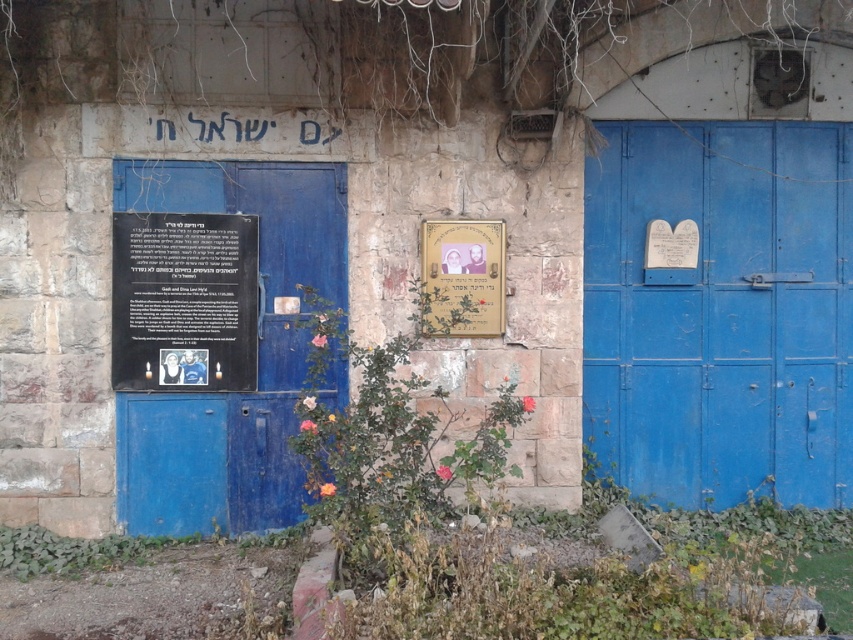
Question: Which of these objects is positioned closest to the green leafy plant at center?

Choices:
 (A) black metal plaque at left
 (B) gold metallic plaque at center
 (C) blue matte door at center
 (D) black matte signboard at left

Answer: (B)

Question: Can you confirm if black matte signboard at left is thinner than gold metallic plaque at center?

Choices:
 (A) yes
 (B) no

Answer: (B)

Question: Which point appears farthest from the camera in this image?

Choices:
 (A) [223, 166]
 (B) [239, 230]
 (C) [608, 186]
 (D) [314, 412]

Answer: (C)

Question: Can you confirm if black metal plaque at left is bigger than black matte signboard at left?

Choices:
 (A) no
 (B) yes

Answer: (B)

Question: Which point is farther to the camera?

Choices:
 (A) (624, 474)
 (B) (489, 289)
 (C) (202, 365)

Answer: (A)

Question: Is blue matte door at center to the right of gold metallic plaque at center from the viewer's perspective?

Choices:
 (A) yes
 (B) no

Answer: (A)